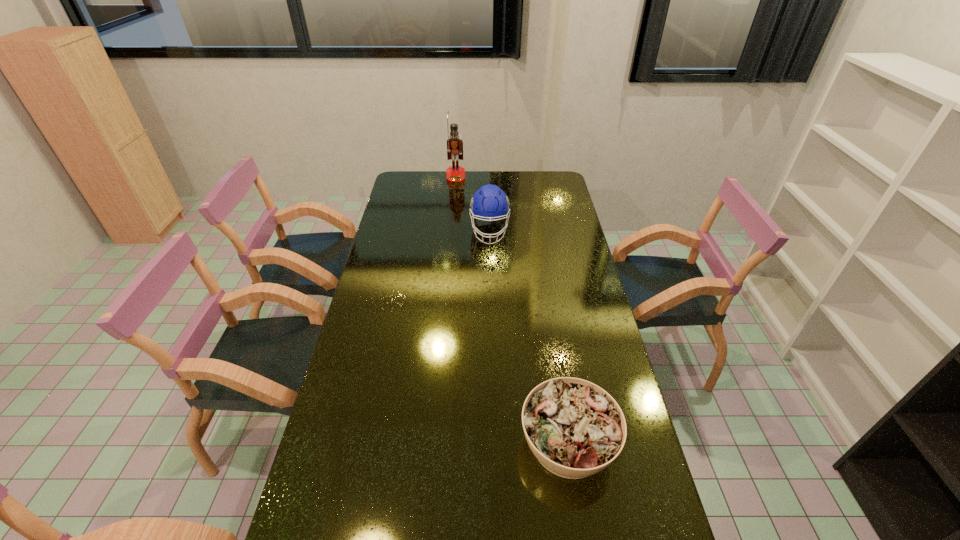
Identify the location of the tallest object. This screenshot has height=540, width=960. (455, 173).

Identify the location of the leftmost object. The width and height of the screenshot is (960, 540). (455, 173).

At what (x,y) coordinates should I click in order to perform the action: click on the second shortest object. Please return your answer as a coordinate pair (x, y). Looking at the image, I should click on (489, 202).

Where is `the second nearest object`? The width and height of the screenshot is (960, 540). the second nearest object is located at coordinates click(489, 202).

Identify the location of salad. (575, 429).

The width and height of the screenshot is (960, 540). I want to click on the shortest object, so click(x=575, y=429).

I want to click on free space located on the front-facing side of the farthest object, so click(x=454, y=195).

The width and height of the screenshot is (960, 540). What are the coordinates of `vacant space located on the front-facing side of the second shortest object` in the screenshot? It's located at (492, 312).

Where is `blank space located 0.220m on the left of the salad`? This screenshot has width=960, height=540. blank space located 0.220m on the left of the salad is located at coordinates (436, 442).

You are a GUI agent. You are given a task and a screenshot of the screen. Output one action in this format:
    pyautogui.click(x=<x>, y=<y>)
    Task: Click on the object situated at the far edge
    
    Given the screenshot: What is the action you would take?
    pyautogui.click(x=455, y=173)